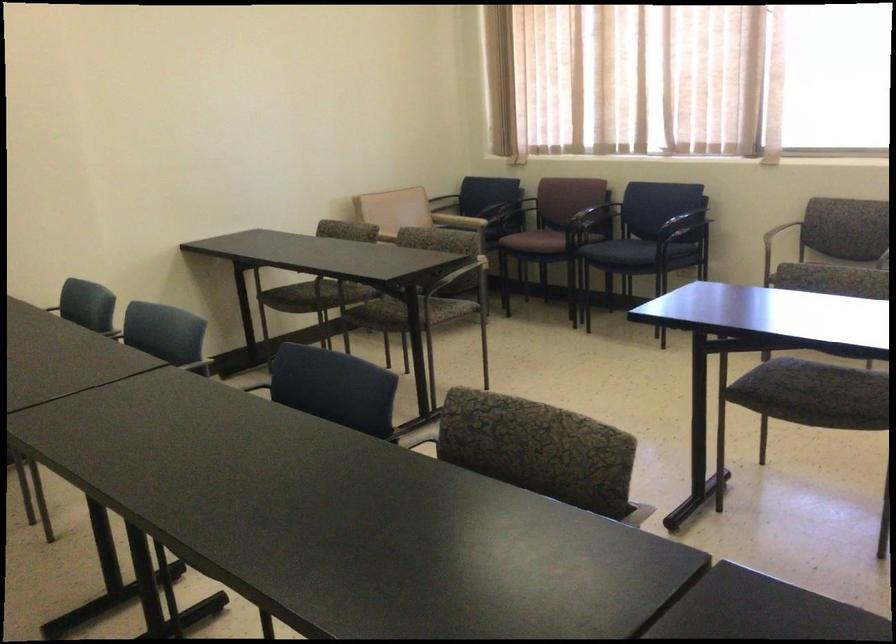
The image size is (896, 644). Identify the location of tan chair armrest. tap(511, 213).